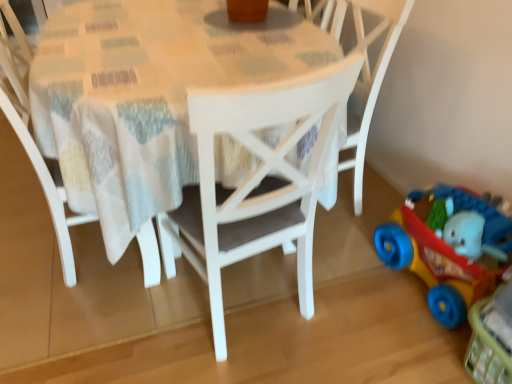
Where is `white matte chair at center, which is the 1th chair from right to left`? Image resolution: width=512 pixels, height=384 pixels. white matte chair at center, which is the 1th chair from right to left is located at coordinates (364, 65).

This screenshot has width=512, height=384. What are the coordinates of `rubberized plastic toy car at lower right` in the screenshot? It's located at (448, 250).

From a real-world perspective, is white painted wood table at center physically below white matte chair at center, which ranks as the second chair in right-to-left order?

Correct, in the physical world, white painted wood table at center is lower than white matte chair at center, which ranks as the second chair in right-to-left order.

Is point (278, 135) positioned behind point (5, 106)?

No, it is in front of (5, 106).

Can you confirm if white painted wood table at center is positioned to the left of white matte chair at center, arranged as the first chair when viewed from the left?

In fact, white painted wood table at center is to the right of white matte chair at center, arranged as the first chair when viewed from the left.

Which of these two, white painted wood table at center or white matte chair at center, which ranks as the second chair in right-to-left order, is smaller?

white matte chair at center, which ranks as the second chair in right-to-left order, is smaller.

Can you tell me how much white matte chair at center, arranged as the first chair when viewed from the left, and rubberized plastic toy car at lower right differ in facing direction?

The facing directions of white matte chair at center, arranged as the first chair when viewed from the left, and rubberized plastic toy car at lower right are 177 degrees apart.

Considering the sizes of objects white matte chair at center, which ranks as the second chair in right-to-left order, and rubberized plastic toy car at lower right in the image provided, who is shorter, white matte chair at center, which ranks as the second chair in right-to-left order, or rubberized plastic toy car at lower right?

With less height is rubberized plastic toy car at lower right.

From a real-world perspective, is white matte chair at center, arranged as the first chair when viewed from the left, physically located above or below rubberized plastic toy car at lower right?

Clearly, from a real-world perspective, white matte chair at center, arranged as the first chair when viewed from the left, is above rubberized plastic toy car at lower right.

Locate an element on the screen. toy to the right of white painted wood table at center is located at coordinates (448, 250).

Is white painted wood table at center thinner than rubberized plastic toy car at lower right?

No.

Is the position of white painted wood table at center more distant than that of rubberized plastic toy car at lower right?

No, white painted wood table at center is closer to the viewer.

Looking at this image, is white matte chair at center, positioned as the 2th chair in left-to-right order, positioned with its back to white matte chair at center, arranged as the first chair when viewed from the left?

No, white matte chair at center, positioned as the 2th chair in left-to-right order, is not facing the opposite direction of white matte chair at center, arranged as the first chair when viewed from the left.

Between white matte chair at center, positioned as the 2th chair in left-to-right order, and white matte chair at center, arranged as the first chair when viewed from the left, which one is positioned in front?

Positioned in front is white matte chair at center, arranged as the first chair when viewed from the left.

From the image's perspective, is white matte chair at center, positioned as the 2th chair in left-to-right order, located beneath white matte chair at center, which ranks as the second chair in right-to-left order?

Incorrect, from the image's perspective, white matte chair at center, positioned as the 2th chair in left-to-right order, is higher than white matte chair at center, which ranks as the second chair in right-to-left order.

Can we say white matte chair at center, which is the 1th chair from right to left, lies outside white matte chair at center, arranged as the first chair when viewed from the left?

Yes.

Is white painted wood table at center turned away from white matte chair at center, which is the 1th chair from right to left?

Absolutely, white painted wood table at center is directed away from white matte chair at center, which is the 1th chair from right to left.

Is white painted wood table at center wider or thinner than white matte chair at center, which is the 1th chair from right to left?

Considering their sizes, white painted wood table at center looks broader than white matte chair at center, which is the 1th chair from right to left.

Consider the image. Can you confirm if white painted wood table at center is positioned to the right of white matte chair at center, positioned as the 2th chair in left-to-right order?

In fact, white painted wood table at center is to the left of white matte chair at center, positioned as the 2th chair in left-to-right order.

Which is more to the left, rubberized plastic toy car at lower right or white painted wood table at center?

From the viewer's perspective, white painted wood table at center appears more on the left side.

Between rubberized plastic toy car at lower right and white painted wood table at center, which one has larger size?

With larger size is white painted wood table at center.

The image size is (512, 384). I want to click on round table to the left of rubberized plastic toy car at lower right, so click(x=147, y=99).

Considering the relative sizes of rubberized plastic toy car at lower right and white painted wood table at center in the image provided, is rubberized plastic toy car at lower right shorter than white painted wood table at center?

Indeed, rubberized plastic toy car at lower right has a lesser height compared to white painted wood table at center.

Is white matte chair at center, which ranks as the second chair in right-to-left order, in front of white matte chair at center, which is the 1th chair from right to left?

Yes, it is in front of white matte chair at center, which is the 1th chair from right to left.

How many degrees apart are the facing directions of white matte chair at center, arranged as the first chair when viewed from the left, and white matte chair at center, positioned as the 2th chair in left-to-right order?

There is a 90-degree angle between the facing directions of white matte chair at center, arranged as the first chair when viewed from the left, and white matte chair at center, positioned as the 2th chair in left-to-right order.

The image size is (512, 384). Find the location of `chair below the white matte chair at center, which is the 1th chair from right to left (from the image's perspective)`. chair below the white matte chair at center, which is the 1th chair from right to left (from the image's perspective) is located at coordinates coord(32,137).

From a real-world perspective, is white matte chair at center, which ranks as the second chair in right-to-left order, physically located above or below white matte chair at center, positioned as the 2th chair in left-to-right order?

From a real-world perspective, white matte chair at center, which ranks as the second chair in right-to-left order, is physically below white matte chair at center, positioned as the 2th chair in left-to-right order.

Locate an element on the screen. This screenshot has width=512, height=384. chair below the white painted wood table at center (from the image's perspective) is located at coordinates (32, 137).

Identify the location of the 2nd chair to the left of the rubberized plastic toy car at lower right, counting from the anchor's position. This screenshot has width=512, height=384. (32, 137).

Based on their spatial positions, is rubberized plastic toy car at lower right or white matte chair at center, which ranks as the second chair in right-to-left order, further from white matte chair at center, which is the 1th chair from right to left?

white matte chair at center, which ranks as the second chair in right-to-left order, is further to white matte chair at center, which is the 1th chair from right to left.

Looking at the image, which one is located closer to white painted wood table at center, white matte chair at center, positioned as the 2th chair in left-to-right order, or rubberized plastic toy car at lower right?

Based on the image, white matte chair at center, positioned as the 2th chair in left-to-right order, appears to be nearer to white painted wood table at center.

Which object lies nearer to the anchor point white painted wood table at center, white matte chair at center, which is the 1th chair from right to left, or white matte chair at center, arranged as the first chair when viewed from the left?

white matte chair at center, arranged as the first chair when viewed from the left, is positioned closer to the anchor white painted wood table at center.

In the scene shown: Estimate the real-world distances between objects in this image. Which object is closer to white matte chair at center, positioned as the 2th chair in left-to-right order, white matte chair at center, arranged as the first chair when viewed from the left, or rubberized plastic toy car at lower right?

rubberized plastic toy car at lower right is closer to white matte chair at center, positioned as the 2th chair in left-to-right order.

Looking at the image, which one is located closer to white matte chair at center, arranged as the first chair when viewed from the left, rubberized plastic toy car at lower right or white matte chair at center, positioned as the 2th chair in left-to-right order?

white matte chair at center, positioned as the 2th chair in left-to-right order, is positioned closer to the anchor white matte chair at center, arranged as the first chair when viewed from the left.

Which object lies nearer to the anchor point white matte chair at center, which ranks as the second chair in right-to-left order, white painted wood table at center or white matte chair at center, which is the 1th chair from right to left?

The object closer to white matte chair at center, which ranks as the second chair in right-to-left order, is white painted wood table at center.

When comparing their distances from white matte chair at center, which is the 1th chair from right to left, does white matte chair at center, which ranks as the second chair in right-to-left order, or white painted wood table at center seem further?

white matte chair at center, which ranks as the second chair in right-to-left order, is further to white matte chair at center, which is the 1th chair from right to left.

Estimate the real-world distances between objects in this image. Which object is closer to white matte chair at center, which ranks as the second chair in right-to-left order, white painted wood table at center or rubberized plastic toy car at lower right?

Based on the image, white painted wood table at center appears to be nearer to white matte chair at center, which ranks as the second chair in right-to-left order.

You are a GUI agent. You are given a task and a screenshot of the screen. Output one action in this format:
    pyautogui.click(x=<x>, y=<y>)
    Task: Click on the round table between white matte chair at center, arranged as the first chair when viewed from the left, and rubberized plastic toy car at lower right, in the horizontal direction
    The image size is (512, 384).
    Given the screenshot: What is the action you would take?
    pyautogui.click(x=147, y=99)

Where is `chair situated between white painted wood table at center and rubberized plastic toy car at lower right from left to right`? The image size is (512, 384). chair situated between white painted wood table at center and rubberized plastic toy car at lower right from left to right is located at coordinates (364, 65).

At what (x,y) coordinates should I click in order to perform the action: click on round table between white matte chair at center, which ranks as the second chair in right-to-left order, and white matte chair at center, which is the 1th chair from right to left. Please return your answer as a coordinate pair (x, y). The width and height of the screenshot is (512, 384). Looking at the image, I should click on (147, 99).

In order to click on chair between white matte chair at center, which ranks as the second chair in right-to-left order, and rubberized plastic toy car at lower right, in the horizontal direction in this screenshot , I will do `click(364, 65)`.